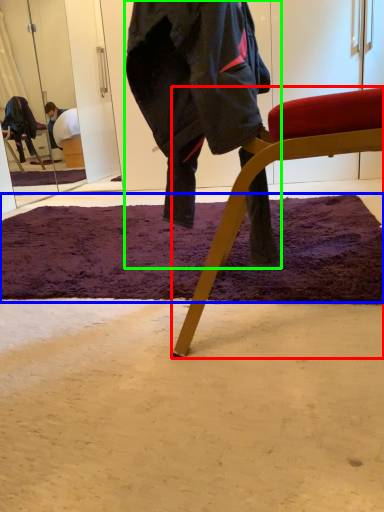
Question: Which object is positioned farthest from chair (highlighted by a red box)? Select from mat (highlighted by a blue box) and person (highlighted by a green box).

Choices:
 (A) mat
 (B) person

Answer: (A)